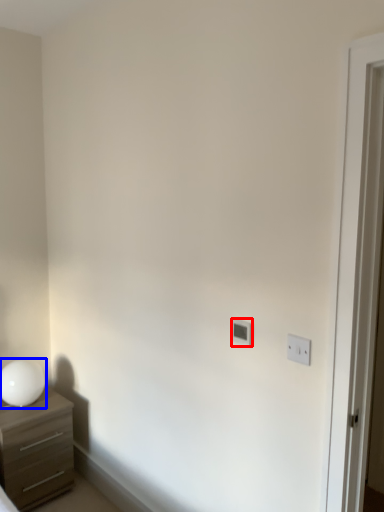
Question: Among these objects, which one is farthest to the camera, light switch (highlighted by a red box) or table lamp (highlighted by a blue box)?

Choices:
 (A) light switch
 (B) table lamp

Answer: (B)